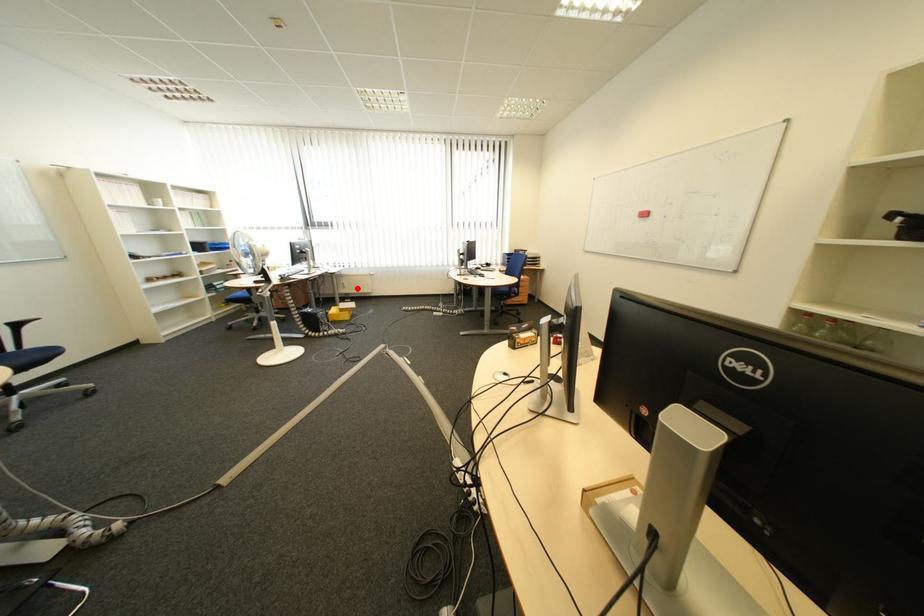
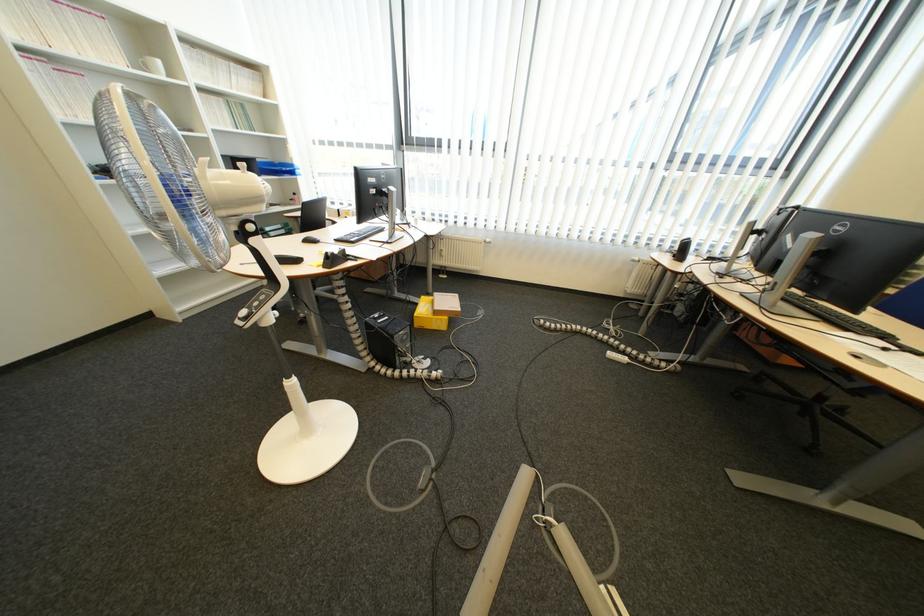
Question: I am providing you with two images of the same scene from different viewpoints. Image1 has a red point marked. In image2, the corresponding 3D location appears at what relative position? Reply with the corresponding letter.

Choices:
 (A) Closer
 (B) Farther

Answer: (B)